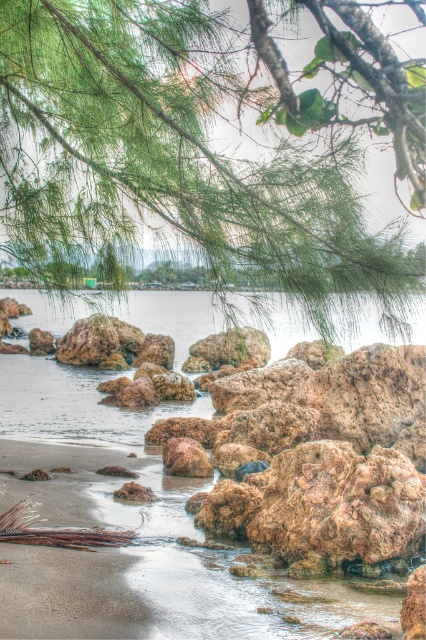
Question: Is green textured branch at upper center closer to camera compared to clear water at center?

Choices:
 (A) yes
 (B) no

Answer: (A)

Question: Which point is farther to the camera?

Choices:
 (A) clear water at center
 (B) green textured branch at upper center

Answer: (A)

Question: Which object appears farthest from the camera in this image?

Choices:
 (A) green textured branch at upper center
 (B) clear water at center

Answer: (B)

Question: Does green textured branch at upper center have a smaller size compared to clear water at center?

Choices:
 (A) yes
 (B) no

Answer: (A)

Question: From the image, what is the correct spatial relationship of green textured branch at upper center in relation to clear water at center?

Choices:
 (A) below
 (B) above

Answer: (B)